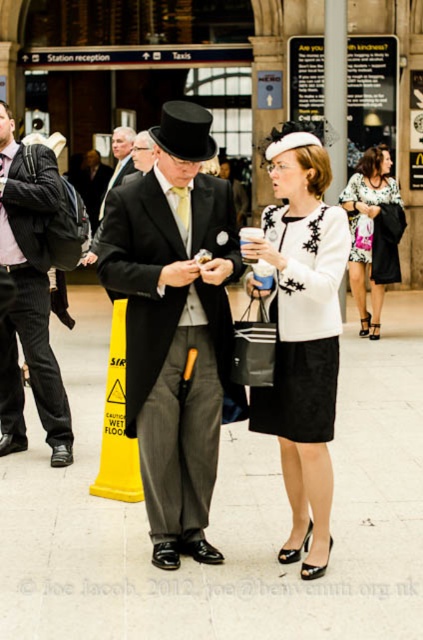
I want to click on white matte dress at center, so click(x=302, y=333).

Does white matte dress at center have a larger size compared to matte black coat at center?

No.

Who is more forward, (299, 193) or (115, 164)?

Point (299, 193)

What are the coordinates of `white matte dress at center` in the screenshot? It's located at (302, 333).

Does shiny black suit at center have a larger size compared to floral dress at center?

Incorrect, shiny black suit at center is not larger than floral dress at center.

Does shiny black suit at center appear on the left side of floral dress at center?

Yes, shiny black suit at center is to the left of floral dress at center.

Does point (153, 179) lie behind point (376, 209)?

That is False.

The height and width of the screenshot is (640, 423). In order to click on shiny black suit at center in this screenshot , I will do `click(175, 324)`.

Which is more to the right, black textured dress at center or matte black coat at center?

black textured dress at center

Can you confirm if black textured dress at center is thinner than matte black coat at center?

Indeed, black textured dress at center has a lesser width compared to matte black coat at center.

Identify the location of black textured dress at center. (304, 324).